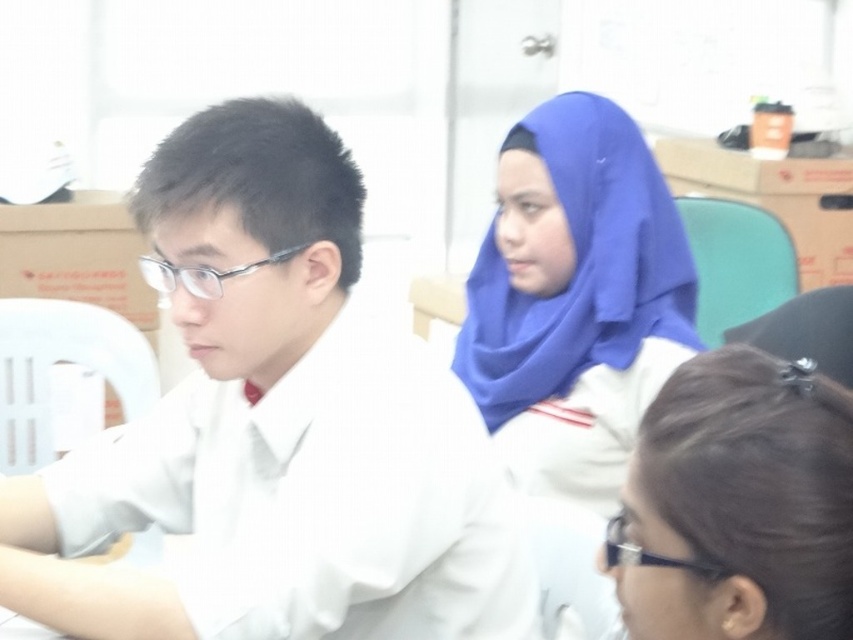
Identify the location of white matte shirt at left. This screenshot has height=640, width=853. (276, 429).

Is white matte shirt at left wider than brown hair at lower right?

Correct, the width of white matte shirt at left exceeds that of brown hair at lower right.

Locate an element on the screen. white matte shirt at left is located at coordinates (276, 429).

Between brown hair at lower right and blue fabric veil at upper center, which one has less height?

Standing shorter between the two is brown hair at lower right.

Is brown hair at lower right to the right of blue fabric veil at upper center from the viewer's perspective?

Incorrect, brown hair at lower right is not on the right side of blue fabric veil at upper center.

Locate an element on the screen. The width and height of the screenshot is (853, 640). brown hair at lower right is located at coordinates (738, 504).

Can you confirm if white matte shirt at left is positioned to the right of blue fabric veil at upper center?

In fact, white matte shirt at left is to the left of blue fabric veil at upper center.

Is point (345, 388) more distant than point (611, 356)?

No, it is in front of (611, 356).

You are a GUI agent. You are given a task and a screenshot of the screen. Output one action in this format:
    pyautogui.click(x=<x>, y=<y>)
    Task: Click on the white matte shirt at left
    This screenshot has height=640, width=853.
    Given the screenshot: What is the action you would take?
    pyautogui.click(x=276, y=429)